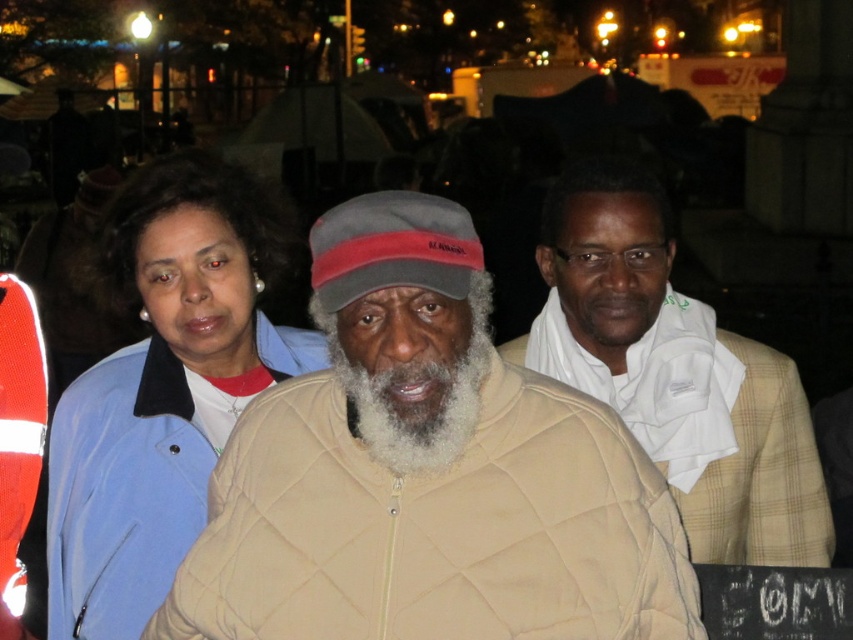
You are a photographer trying to capture a group photo of the three people in the scene. You want to ensure that the tan quilted jacket at center and the white textured scarf at center are both clearly visible in the frame. Based on their positions, which object should you focus on first to ensure both are in focus?

The tan quilted jacket at center is to the left of the white textured scarf at center, so focusing on the tan quilted jacket at center first would ensure both are in focus since it is closer to the left edge of the frame.

Consider the image. You are a photographer trying to capture a closeup of the white fuzzy beard at center without including the tan quilted jacket at center. Based on their positions, is this possible?

The tan quilted jacket at center is positioned on the left side of white fuzzy beard at center, so if you move your camera to the right side of the jacket, you can capture the beard without including the jacket.

Based on the scene description, where is the tan quilted jacket at center located in terms of coordinates?

The tan quilted jacket at center is located at coordinates point (x=427, y=474).